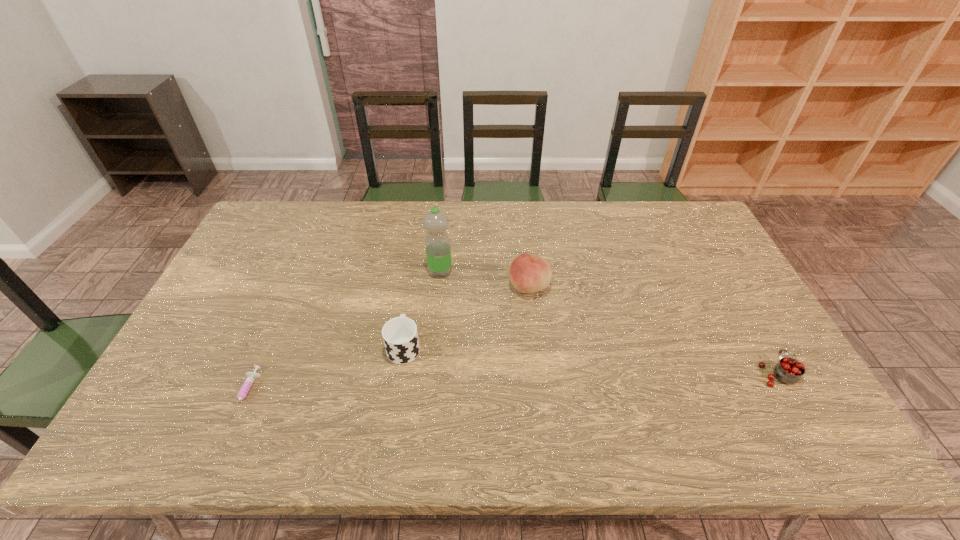
The image size is (960, 540). I want to click on water bottle, so click(437, 243).

Locate an element on the screen. The height and width of the screenshot is (540, 960). the fourth shortest object is located at coordinates (528, 273).

Locate an element on the screen. peach is located at coordinates (528, 273).

This screenshot has height=540, width=960. Identify the location of cup. (400, 336).

Image resolution: width=960 pixels, height=540 pixels. I want to click on cherry, so click(x=789, y=370).

At what (x,y) coordinates should I click in order to perform the action: click on the shortest object. Please return your answer as a coordinate pair (x, y). The height and width of the screenshot is (540, 960). Looking at the image, I should click on (251, 376).

What are the coordinates of `the leftmost object` in the screenshot? It's located at (251, 376).

Locate an element on the screen. The height and width of the screenshot is (540, 960). free spot located 0.290m on the right of the tallest object is located at coordinates pyautogui.click(x=543, y=272).

The height and width of the screenshot is (540, 960). In order to click on vacant point located on the left of the peach in this screenshot , I will do `click(475, 287)`.

I want to click on free region located on the side of the cup with the handle, so click(x=414, y=286).